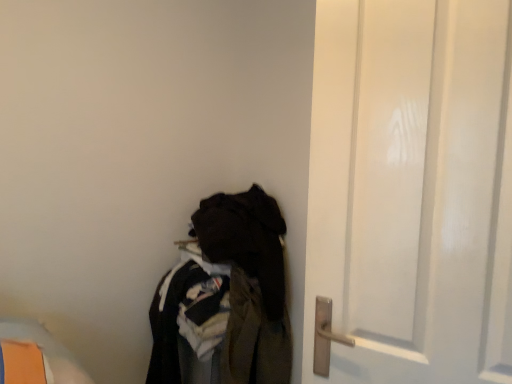
Question: Is dark fabric clothes at lower left completely or partially outside of white matte door at right?

Choices:
 (A) no
 (B) yes

Answer: (B)

Question: Is dark fabric clothes at lower left placed right next to white matte door at right?

Choices:
 (A) yes
 (B) no

Answer: (B)

Question: Is dark fabric clothes at lower left in front of white matte door at right?

Choices:
 (A) yes
 (B) no

Answer: (B)

Question: From a real-world perspective, does dark fabric clothes at lower left stand above white matte door at right?

Choices:
 (A) no
 (B) yes

Answer: (A)

Question: Considering the relative sizes of dark fabric clothes at lower left and white matte door at right in the image provided, is dark fabric clothes at lower left shorter than white matte door at right?

Choices:
 (A) no
 (B) yes

Answer: (A)

Question: From the image's perspective, is dark fabric clothes at lower left under white matte door at right?

Choices:
 (A) no
 (B) yes

Answer: (B)

Question: Is white matte door at right to the left of dark fabric clothes at lower left from the viewer's perspective?

Choices:
 (A) yes
 (B) no

Answer: (B)

Question: Is white matte door at right smaller than dark fabric clothes at lower left?

Choices:
 (A) no
 (B) yes

Answer: (B)

Question: Is the position of white matte door at right less distant than that of dark fabric clothes at lower left?

Choices:
 (A) yes
 (B) no

Answer: (A)

Question: Is white matte door at right outside of dark fabric clothes at lower left?

Choices:
 (A) no
 (B) yes

Answer: (B)

Question: Could dark fabric clothes at lower left be considered to be inside white matte door at right?

Choices:
 (A) no
 (B) yes

Answer: (A)

Question: Is white matte door at right looking in the opposite direction of dark fabric clothes at lower left?

Choices:
 (A) no
 (B) yes

Answer: (A)

Question: Is dark fabric clothes at lower left inside or outside of white matte door at right?

Choices:
 (A) inside
 (B) outside

Answer: (B)